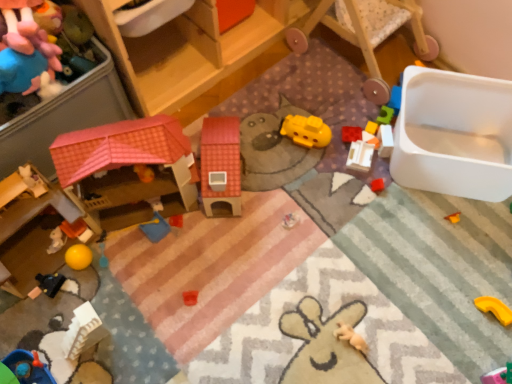
Locate an element on the screen. free space in front of blue fabric toy at center, acting as the ninth toy starting from the right is located at coordinates (154, 285).